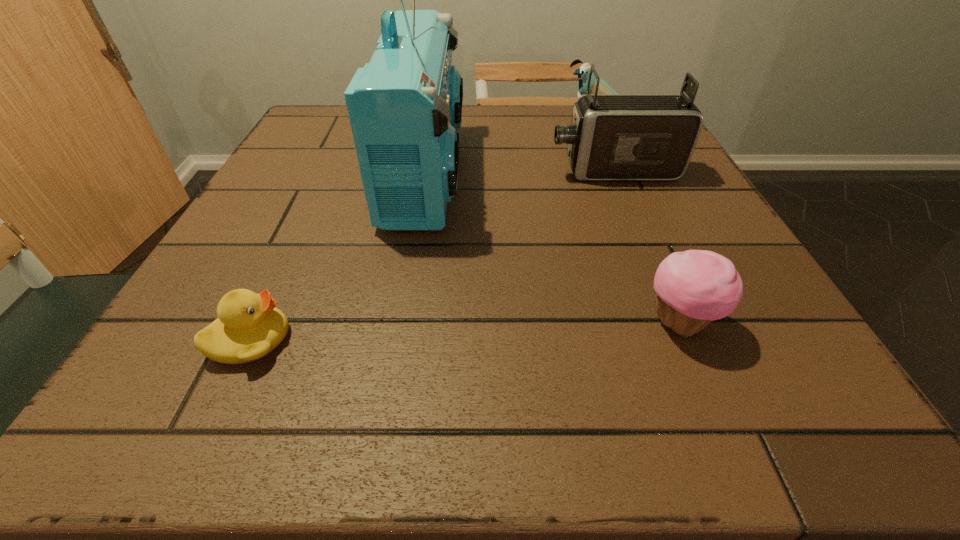
This screenshot has height=540, width=960. I want to click on free location located at the lens of the second tallest object, so click(495, 171).

Image resolution: width=960 pixels, height=540 pixels. Identify the location of vacant space located 0.230m at the face of the bird. (468, 122).

At what (x,y) coordinates should I click in order to perform the action: click on free space located 0.100m at the face of the bird. Please return your answer as a coordinate pair (x, y). The image size is (960, 540). Looking at the image, I should click on (521, 122).

This screenshot has width=960, height=540. I want to click on free region located 0.270m at the face of the bird, so click(x=451, y=122).

Identify the location of free space located 0.250m on the left of the fourth tallest object. (463, 322).

At what (x,y) coordinates should I click in order to perform the action: click on free location located on the beak of the shortest object. Please return your answer as a coordinate pair (x, y). Looking at the image, I should click on tap(340, 340).

Where is `radio receiver that is at the far edge`? This screenshot has width=960, height=540. radio receiver that is at the far edge is located at coordinates (405, 106).

This screenshot has height=540, width=960. Identify the location of bird that is positioned at the far edge. (583, 72).

Locate an element on the screen. This screenshot has width=960, height=540. object at the near edge is located at coordinates (249, 326).

Locate an element on the screen. object that is at the left edge is located at coordinates (249, 326).